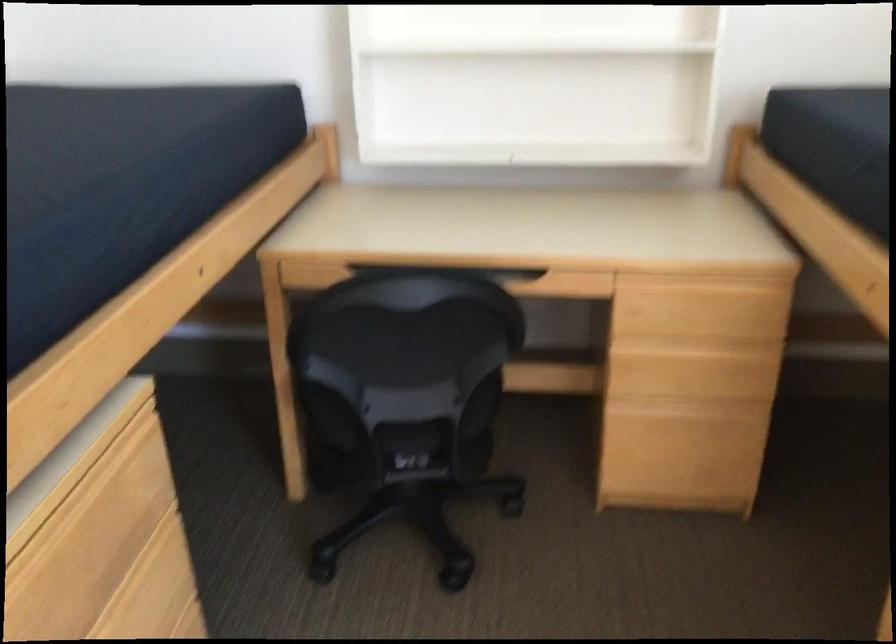
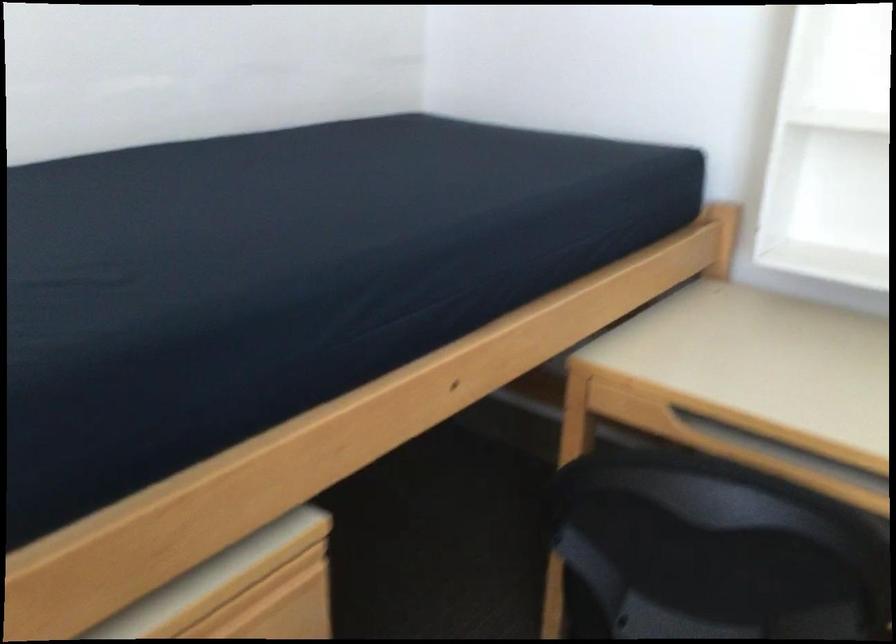
Question: The camera is either moving clockwise (left) or counter-clockwise (right) around the object. The first image is from the beginning of the video and the second image is from the end. Is the camera moving left or right when shooting the video?

Choices:
 (A) Left
 (B) Right

Answer: (B)